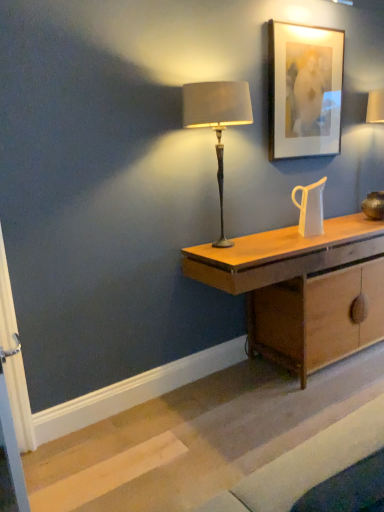
Locate an element on the screen. The image size is (384, 512). free space above matte wooden picture frame at upper right (from a real-world perspective) is located at coordinates (310, 19).